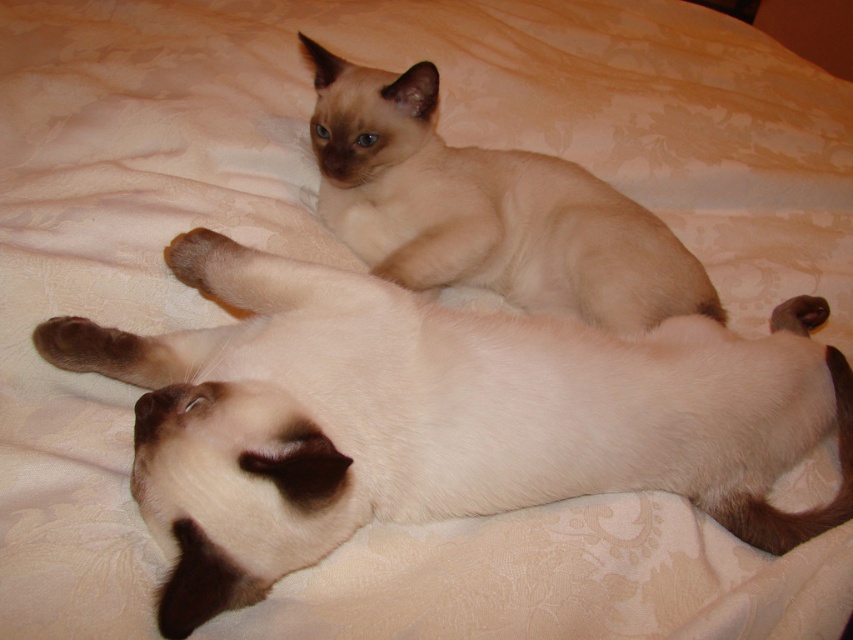
You are a photographer trying to capture both cats in a single frame. Given that your camera can only focus on objects within a 1.5 meter width, will the matte cream cat at center and the light brown fur cat at upper center fit within the frame?

The matte cream cat at center is larger in width than the light brown fur cat at upper center. However, the exact combined width of both cats isn t specified. Without knowing their exact positions and spacing between them, it s impossible to determine if they ll fit within the 1.5 meter frame. Additional information about their arrangement is needed.

You are a veterinarian examining an image of two Siamese cats on a bed. The coordinates point to a specific cat. Which cat is at the coordinates point (436, 417)?

The point (436, 417) indicates the matte cream cat at center.

From the picture: You are a photographer trying to capture a portrait of both the matte cream cat at center and the light brown fur cat at upper center. Since you want to ensure both cats are fully visible in the frame, which cat should you position closer to the camera to avoid any part of them being cut off?

The matte cream cat at center is not as tall as the light brown fur cat at upper center, so you should position the light brown fur cat at upper center closer to the camera to ensure both are fully visible.